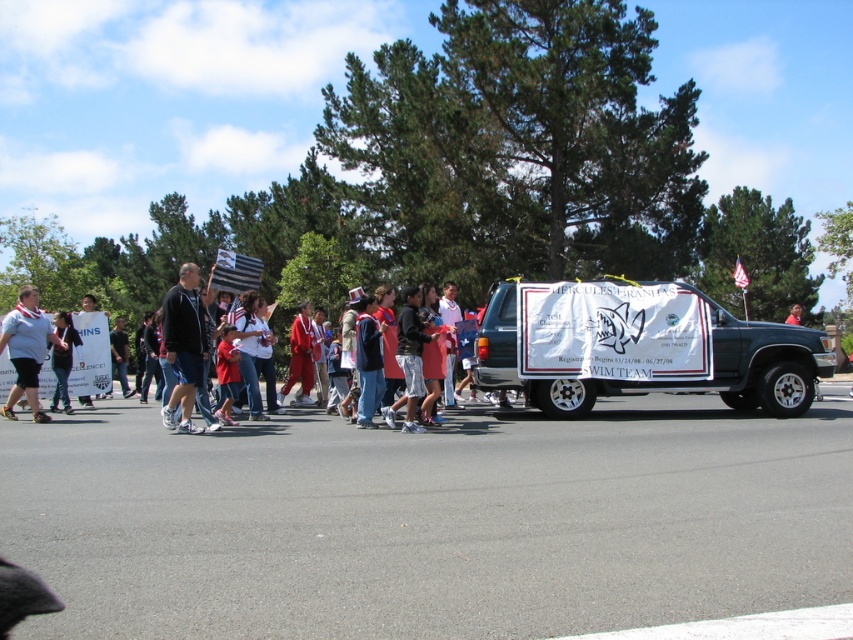
Question: Which of the following is the farthest from the observer?

Choices:
 (A) red fabric sign at center
 (B) white fabric flag at center
 (C) american flag at center
 (D) white vinyl banner at center

Answer: (C)

Question: Which of these objects is positioned farthest from the red fabric sign at center?

Choices:
 (A) american flag at center
 (B) matte gray shirt at left

Answer: (B)

Question: Which of the following is the farthest from the observer?

Choices:
 (A) (189, 385)
 (B) (714, 385)

Answer: (B)

Question: Is white fabric flag at center positioned before red fabric sign at center?

Choices:
 (A) no
 (B) yes

Answer: (B)

Question: Is matte black jacket at center smaller than american flag at center?

Choices:
 (A) yes
 (B) no

Answer: (A)

Question: Is white fabric flag at center positioned in front of red fabric sign at center?

Choices:
 (A) yes
 (B) no

Answer: (A)